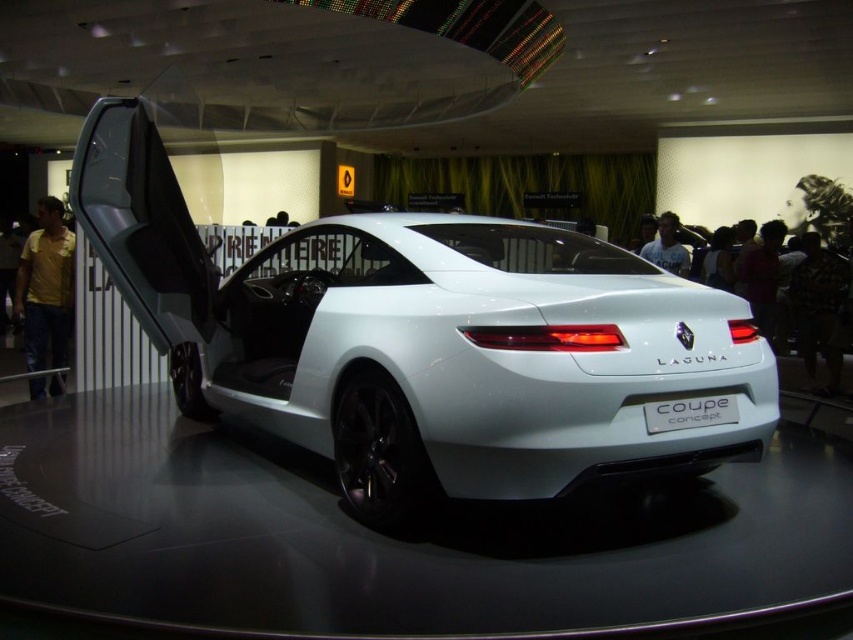
Question: Which object appears closest to the camera in this image?

Choices:
 (A) yellow cotton shirt at left
 (B) white matte coupe at center

Answer: (B)

Question: Considering the real-world distances, which object is closest to the white matte coupe at center?

Choices:
 (A) dark hair at upper right
 (B) yellow cotton shirt at left

Answer: (B)

Question: Estimate the real-world distances between objects in this image. Which object is farther from the dark hair at upper right?

Choices:
 (A) white matte coupe at center
 (B) yellow cotton shirt at left

Answer: (B)

Question: In this image, where is white matte coupe at center located relative to dark hair at upper right?

Choices:
 (A) above
 (B) below

Answer: (B)

Question: Does yellow cotton shirt at left appear on the left side of dark hair at upper right?

Choices:
 (A) yes
 (B) no

Answer: (A)

Question: Is white matte coupe at center thinner than dark hair at upper right?

Choices:
 (A) no
 (B) yes

Answer: (A)